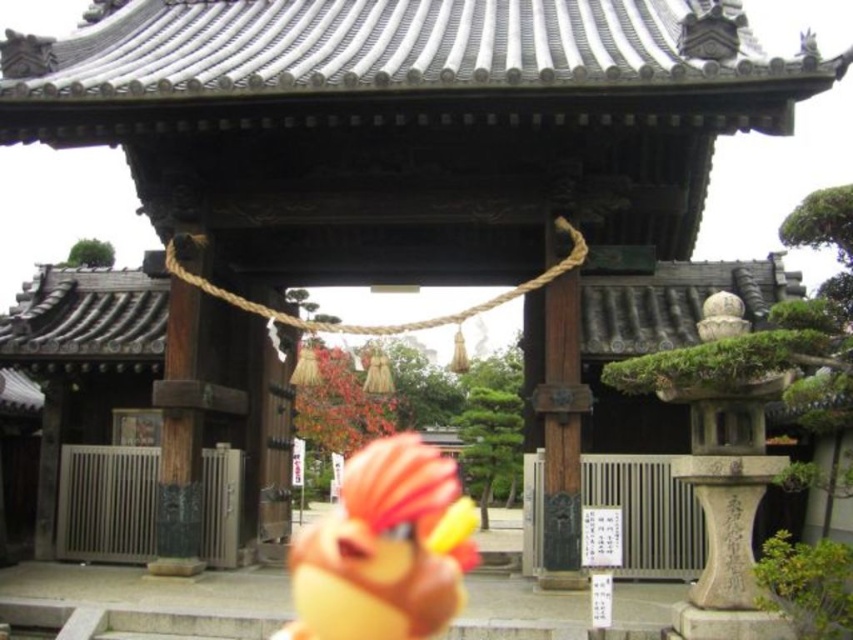
Between matte orange plush toy at center and wooden post at center, which one is positioned higher?

Positioned higher is wooden post at center.

Can you confirm if matte orange plush toy at center is smaller than wooden post at center?

Actually, matte orange plush toy at center might be larger than wooden post at center.

Is point (428, 552) less distant than point (547, 516)?

No, it is not.

Locate an element on the screen. matte orange plush toy at center is located at coordinates (386, 548).